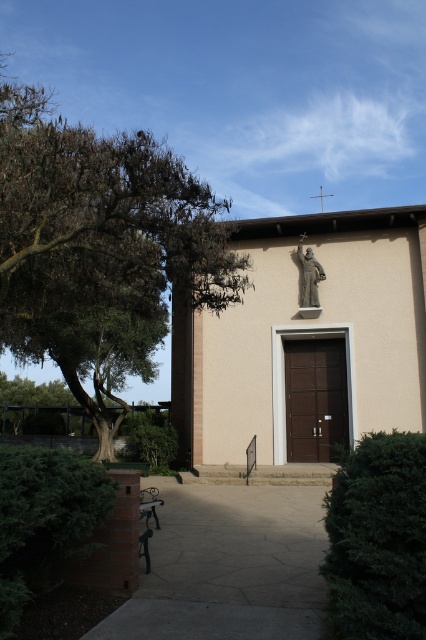
You are standing at the entrance of the church and want to sit down. The wooden park bench at center is your target. However, there is a green leafy tree at left in the way. Can you walk straight towards the bench without going around the tree?

The green leafy tree at left is in front of the wooden park bench at center, so walking straight towards the bench would require passing in front of the tree. Since the tree is blocking the path directly ahead, you would need to go around it to reach the bench safely.

You are standing at the entrance of the church and want to find the green leafy tree at left. Based on the 2D coordinates given, in which direction should you look to see it?

The green leafy tree at left is located at coordinates (100, 250). Since the x coordinate is 0.391, which is less than 0.5, it is positioned to the left side of the image. The y coordinate is 0.237, which is below the center vertically. Therefore, you should look to your left and slightly downward to locate the green leafy tree at left.